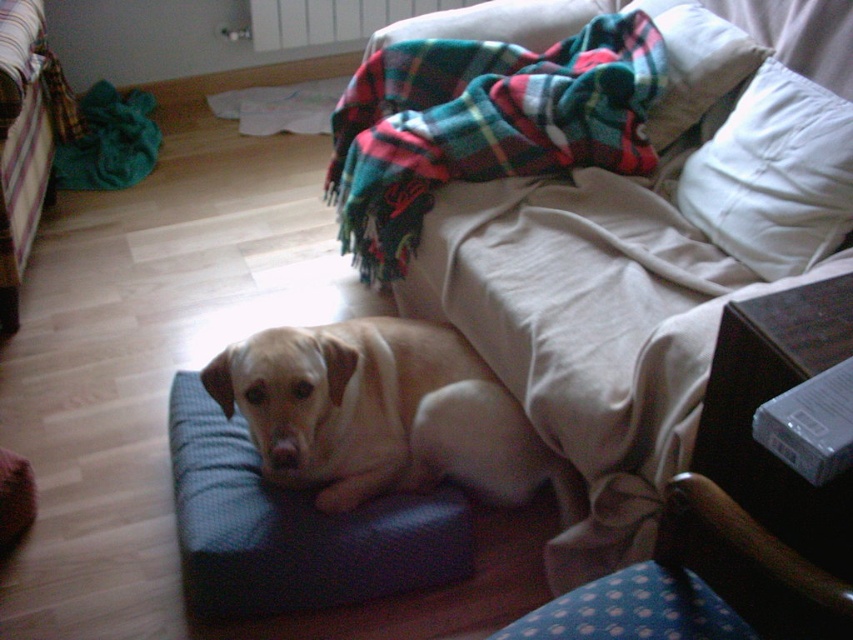
Based on the photo, you are arranging a cozy reading corner in the living room. You have a plaid woolen blanket at upper center and a plaid fabric pillow at upper right. Which item should you place on the sofa to ensure the pillow stays in place?

The plaid woolen blanket at upper center should be placed under the plaid fabric pillow at upper right to keep it in place, as the plaid woolen blanket at upper center is positioned under plaid fabric pillow at upper right.

You are standing in the room and want to place a small potted plant on the plaid woolen blanket at upper center. Based on the coordinates provided, can you determine if the blanket is large enough to accommodate the plant?

The plaid woolen blanket at upper center is located at coordinates point (482, 124), but the question of its size isn not addressed in the description. Therefore, it is impossible to determine if the blanket is large enough to hold the plant based on the given information.

You are trying to decide where to place a new small decorative item in the room. The blue fabric dog bed at center and the white soft pillow at upper right are both present. Which object would allow more space for the item if placed next to it?

The blue fabric dog bed at center is larger in size than the white soft pillow at upper right, so placing the new item next to the blue fabric dog bed at center would provide more space.